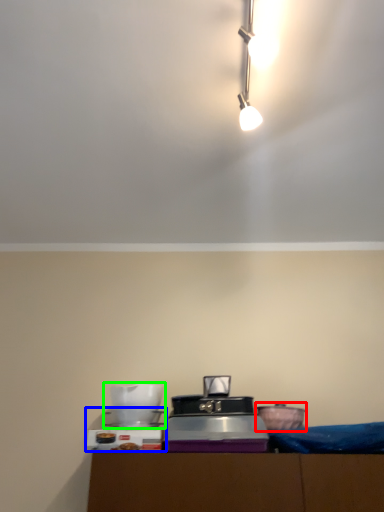
Question: Based on their relative distances, which object is nearer to appliance (highlighted by a red box)? Choose from appliance (highlighted by a blue box) and appliance (highlighted by a green box).

Choices:
 (A) appliance
 (B) appliance

Answer: (B)